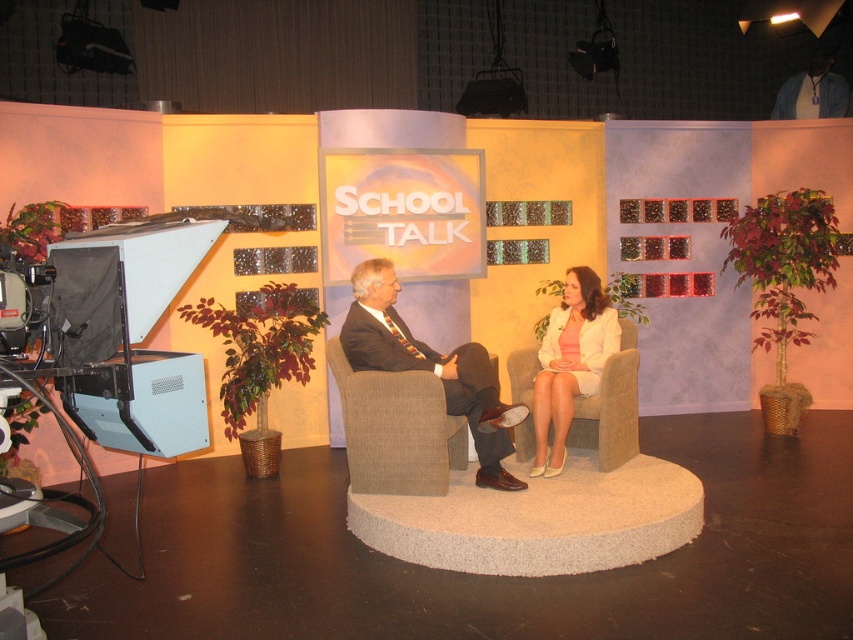
Which of these two, matte black suit at center or white fabric jacket at center, stands shorter?

Standing shorter between the two is white fabric jacket at center.

Is point (374, 364) farther from camera compared to point (576, 385)?

No.

I want to click on matte black suit at center, so click(x=431, y=369).

Can you confirm if beige fabric armchair at center is positioned to the right of white fabric jacket at center?

No, beige fabric armchair at center is not to the right of white fabric jacket at center.

Is beige fabric armchair at center taller than white fabric jacket at center?

No, beige fabric armchair at center is not taller than white fabric jacket at center.

Does point (366, 484) come in front of point (581, 282)?

Yes, it is in front of point (581, 282).

Where is `beige fabric armchair at center`? The height and width of the screenshot is (640, 853). beige fabric armchair at center is located at coordinates (396, 429).

Is beige fabric armchair at center above matte black suit at center?

No, beige fabric armchair at center is not above matte black suit at center.

Does beige fabric armchair at center have a lesser width compared to matte black suit at center?

Correct, beige fabric armchair at center's width is less than matte black suit at center's.

Describe the element at coordinates (396, 429) in the screenshot. I see `beige fabric armchair at center` at that location.

This screenshot has height=640, width=853. In order to click on beige fabric armchair at center in this screenshot , I will do pos(396,429).